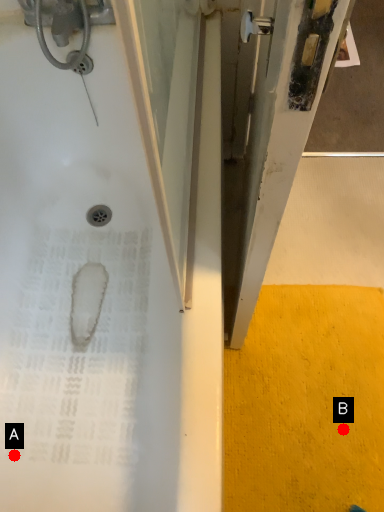
Question: Two points are circled on the image, labeled by A and B beside each circle. Which point is further to the camera?

Choices:
 (A) A is further
 (B) B is further

Answer: (B)